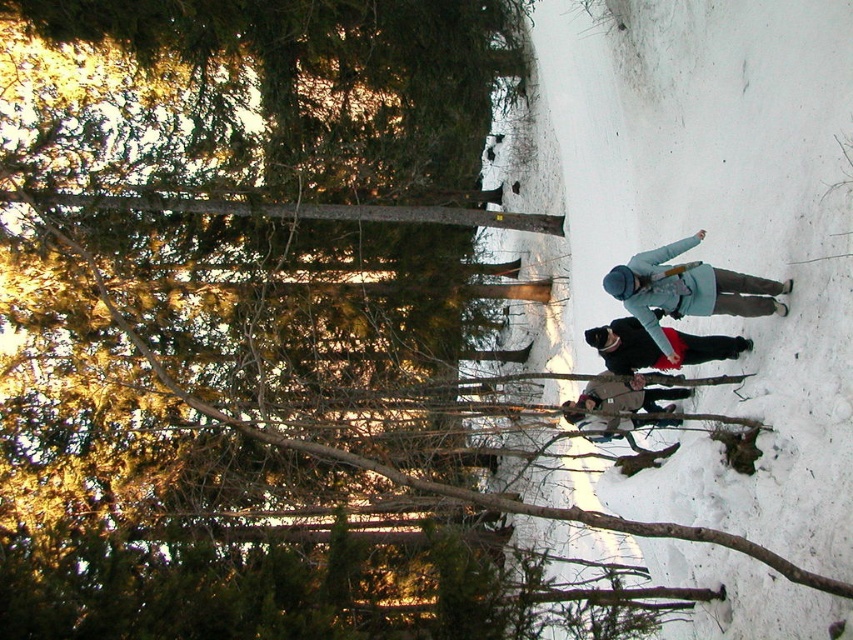
You are a photographer trying to capture a clear shot of the brown woolen jacket at center without the black fur coat at center blocking it. What should you do?

The brown woolen jacket at center is behind the black fur coat at center. To capture a clear shot of the brown woolen jacket at center, you should move your position so that the black fur coat at center is no longer in front of it.

You are standing at the bottom of the snowy slope and want to reach the black fur coat at center. Which direction should you move to get closer to it?

Since the black fur coat at center is located at point 0.542 on the x axis and 0.771 on the y axis, you should move towards the upper middle area of the slope to reach it.